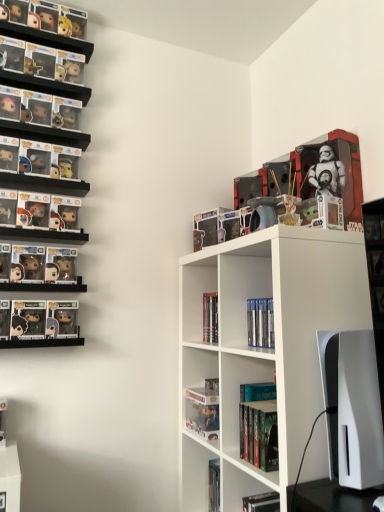
Question: Is clear plastic figure at lower center, which is counted as the fourth book, starting from the top, bigger or smaller than clear plastic book at upper center, which is the fifth book in bottom-to-top order?

Choices:
 (A) small
 (B) big

Answer: (A)

Question: From a real-world perspective, is clear plastic figure at lower center, which is counted as the fourth book, starting from the top, positioned above or below clear plastic book at upper center, which is the fifth book in bottom-to-top order?

Choices:
 (A) above
 (B) below

Answer: (B)

Question: Which object is the closest to the white glossy monitor at right?

Choices:
 (A) white matte shelf at center
 (B) clear plastic figure at lower center, arranged as the second book when ordered from the bottom
 (C) clear plastic book at upper center, which is the 1th book in top-to-bottom order
 (D) hardcover book at center, which ranks as the 3th book in top-to-bottom order
 (E) hardcover book at lower center, which is the 1th book in bottom-to-top order

Answer: (D)

Question: Which is farther from the white matte shelf at center?

Choices:
 (A) hardcover book at center, which ranks as the 3th book in top-to-bottom order
 (B) hardcover book at center, arranged as the 2th book when viewed from the top
 (C) clear plastic book at upper center, which is the 1th book in top-to-bottom order
 (D) white glossy monitor at right
 (E) clear plastic figure at lower center, arranged as the second book when ordered from the bottom

Answer: (C)